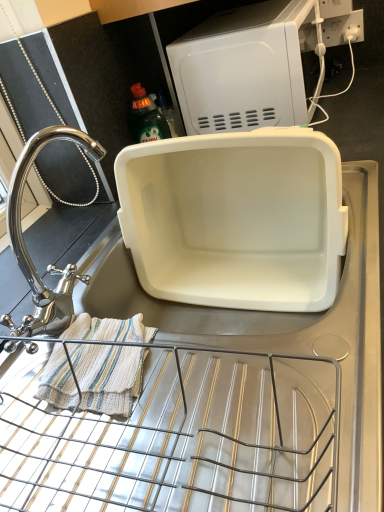
Question: Is white plastic microwave at upper center, the 1th appliance in the top-to-bottom sequence, taller or shorter than white plastic container at center, which is the second appliance from top to bottom?

Choices:
 (A) short
 (B) tall

Answer: (A)

Question: Considering the positions of white plastic microwave at upper center, placed as the 2th appliance when sorted from bottom to top, and white plastic container at center, the 1th appliance positioned from the bottom, in the image, is white plastic microwave at upper center, placed as the 2th appliance when sorted from bottom to top, bigger or smaller than white plastic container at center, the 1th appliance positioned from the bottom,?

Choices:
 (A) big
 (B) small

Answer: (A)

Question: Estimate the real-world distances between objects in this image. Which object is closer to the white plastic electric outlet at upper right?

Choices:
 (A) white plastic container at center, which is the second appliance from top to bottom
 (B) polished chrome faucet at left
 (C) white plastic microwave at upper center, placed as the 2th appliance when sorted from bottom to top
 (D) striped cotton towel at lower left

Answer: (C)

Question: Which object is positioned closest to the striped cotton towel at lower left?

Choices:
 (A) polished chrome faucet at left
 (B) white plastic electric outlet at upper right
 (C) white plastic microwave at upper center, placed as the 2th appliance when sorted from bottom to top
 (D) white plastic container at center, the 1th appliance positioned from the bottom

Answer: (A)